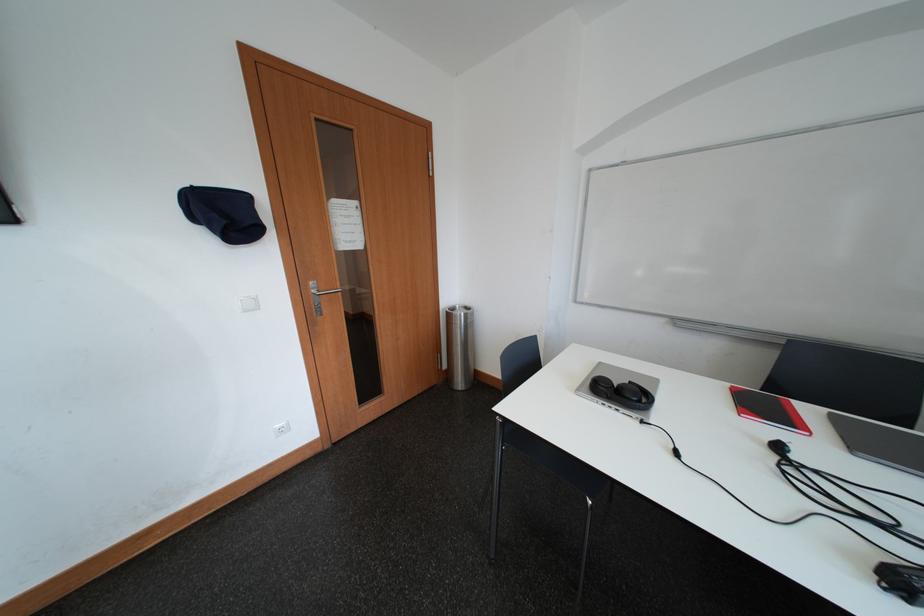
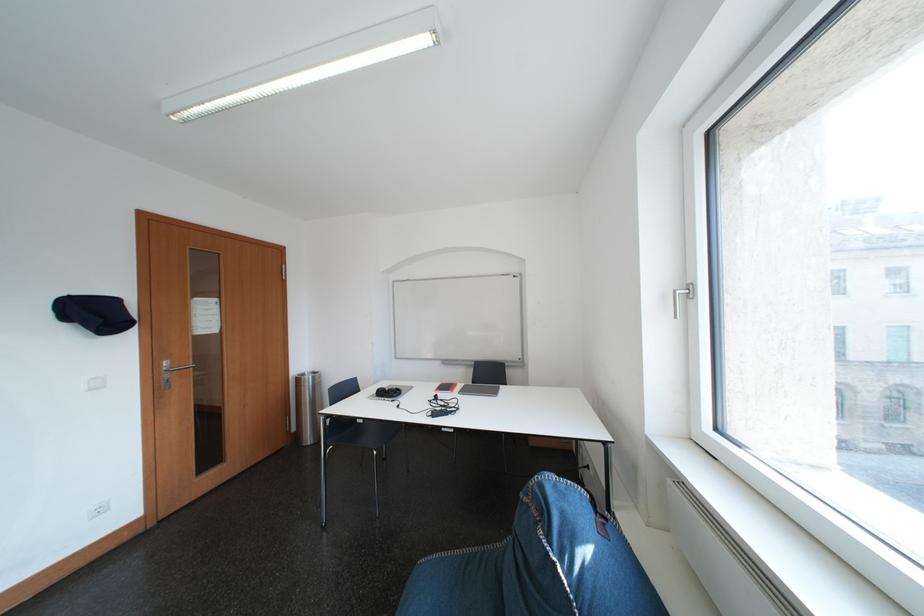
Find the pixel in the second image that matches (x=821, y=416) in the first image.

(470, 390)